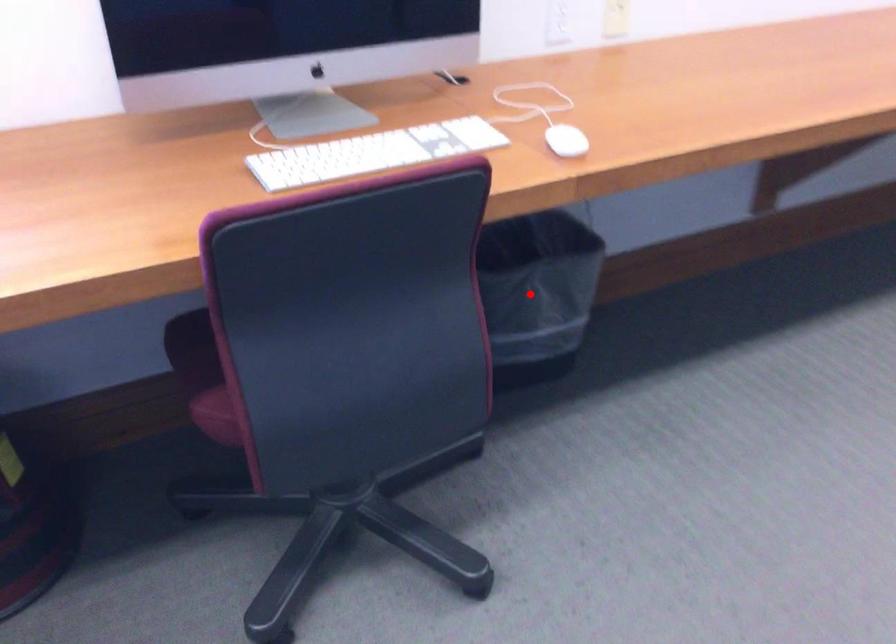
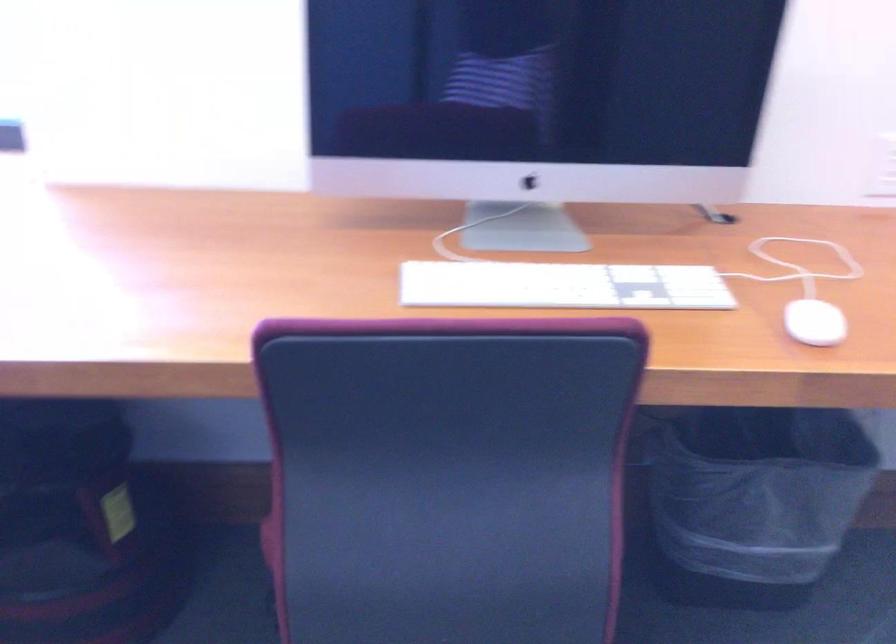
Question: I am providing you with two images of the same scene from different viewpoints. A red point is shown in image1. For the corresponding object point in image2, is it positioned nearer or farther from the camera?

Choices:
 (A) Nearer
 (B) Farther

Answer: (A)